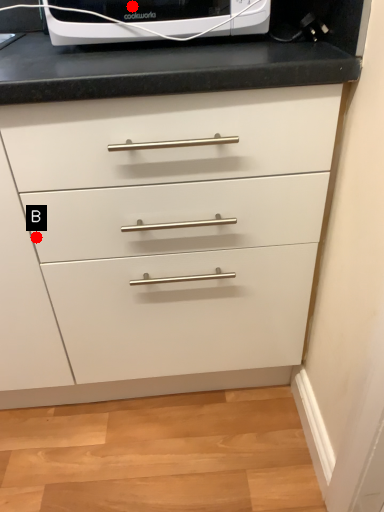
Question: Two points are circled on the image, labeled by A and B beside each circle. Among these points, which one is nearest to the camera?

Choices:
 (A) A is closer
 (B) B is closer

Answer: (A)